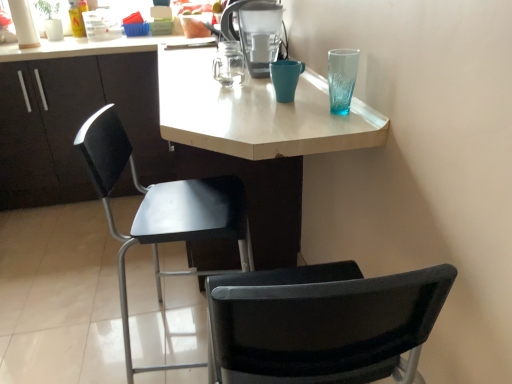
In order to click on vacant space in front of teal ceramic mug at upper center in this screenshot , I will do `click(301, 117)`.